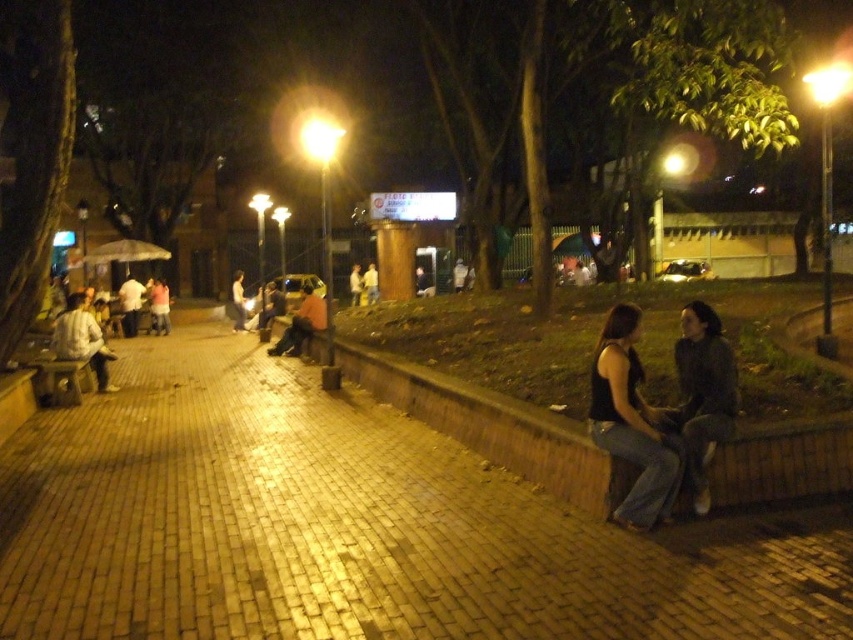
Question: Which point is closer to the camera taking this photo?

Choices:
 (A) (686, 403)
 (B) (299, 353)
 (C) (592, 372)
 (D) (56, 328)

Answer: (C)

Question: Does orange fabric jacket at center have a smaller size compared to light pink fabric shirt at center?

Choices:
 (A) no
 (B) yes

Answer: (A)

Question: Is black matte tank top at lower right below light brown leather jacket at center?

Choices:
 (A) no
 (B) yes

Answer: (B)

Question: Considering the real-world distances, which object is farthest from the white shirt at left?

Choices:
 (A) light brown leather jacket at center
 (B) orange fabric jacket at center
 (C) black matte tank top at lower right

Answer: (A)

Question: Considering the real-world distances, which object is closest to the black matte tank top at lower right?

Choices:
 (A) dark gray sweater at right
 (B) light brown leather jacket at center

Answer: (A)

Question: Does orange fabric jacket at center lie in front of light pink fabric shirt at center?

Choices:
 (A) yes
 (B) no

Answer: (A)